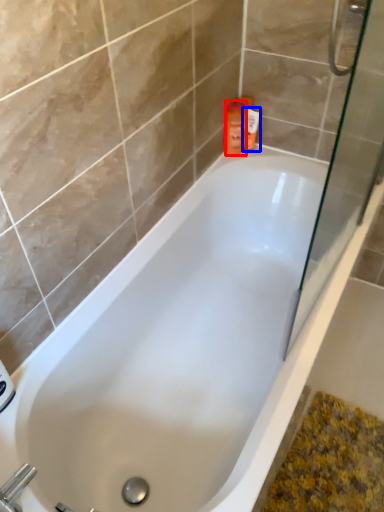
Question: Among these objects, which one is farthest to the camera, cleaning product (highlighted by a red box) or toiletry (highlighted by a blue box)?

Choices:
 (A) cleaning product
 (B) toiletry

Answer: (B)